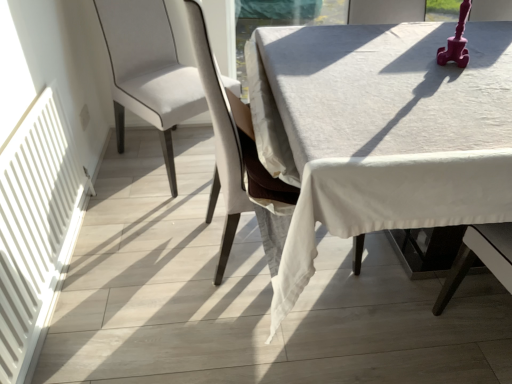
Question: Considering the relative positions of white matte radiator at left and white linen table at center in the image provided, is white matte radiator at left to the left or to the right of white linen table at center?

Choices:
 (A) left
 (B) right

Answer: (A)

Question: Considering the positions of white matte radiator at left and white linen table at center in the image, is white matte radiator at left wider or thinner than white linen table at center?

Choices:
 (A) wide
 (B) thin

Answer: (B)

Question: Which is nearer to the white fabric chair at center, the 2th chair in the left-to-right sequence?

Choices:
 (A) white linen table at center
 (B) white matte radiator at left
 (C) satin white chair at center, which is the 2th chair in right-to-left order

Answer: (A)

Question: Which object is the farthest from the white linen table at center?

Choices:
 (A) white matte radiator at left
 (B) satin white chair at center, which is the 2th chair in right-to-left order
 (C) white fabric chair at center, the 1th chair in the right-to-left sequence

Answer: (A)